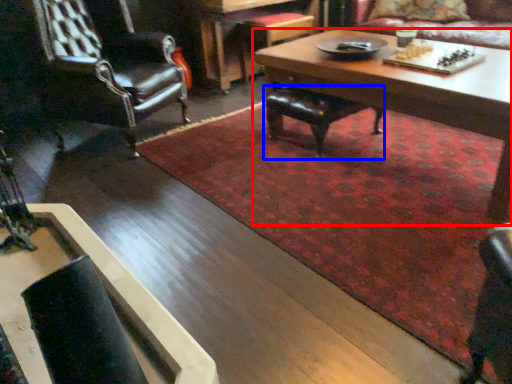
Question: Among these objects, which one is nearest to the camera, coffee table (highlighted by a red box) or chair (highlighted by a blue box)?

Choices:
 (A) coffee table
 (B) chair

Answer: (A)